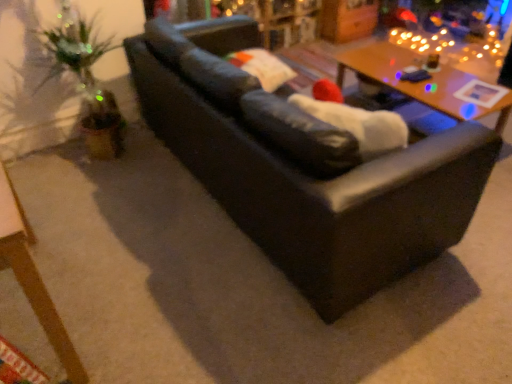
Find the location of a particular element. The width and height of the screenshot is (512, 384). vacant space behind wooden table at lower left, the 1th table positioned from the front is located at coordinates (93, 215).